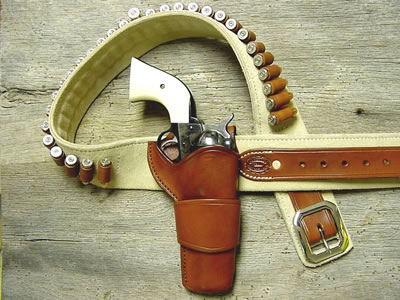
What are the coordinates of `old nail hole` in the screenshot? It's located at (360, 113).